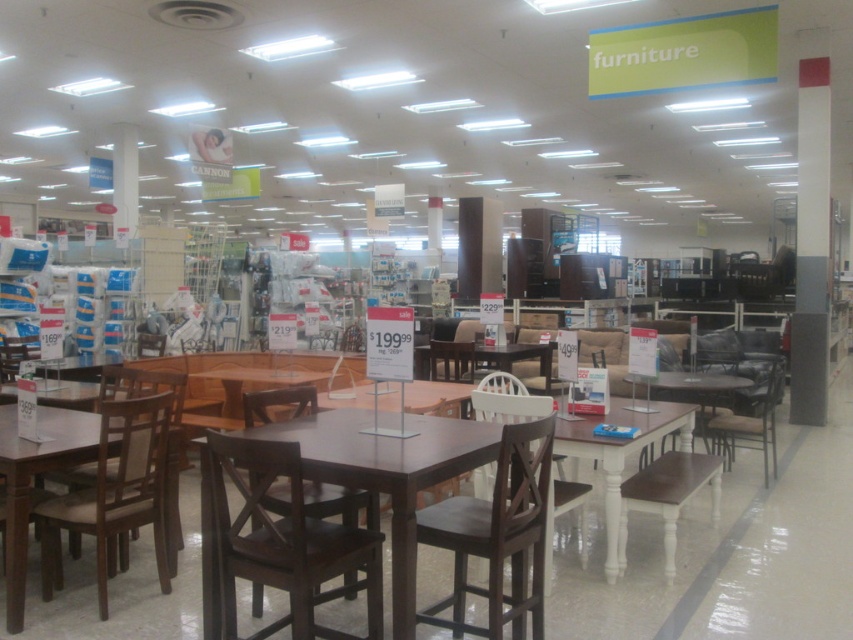
Looking at this image, you are a customer in the furniture store and want to sit down at the white wood table at center. Can you reach the matte brown chair at left from your current position near the entrance?

The matte brown chair at left is to the left of the white wood table at center, so you can reach it by moving towards the left side of the table.

You are a customer in the furniture store and want to know if the matte brown chair at left can fit under the white wood table at center. Based on their sizes, can it fit?

The matte brown chair at left is bigger than the white wood table at center, so it may not fit under the table since the chair is larger in size.

You are a customer in the furniture store and want to know if there is enough space between the dark wood table at center and the white wood chair at center to walk through comfortably. The store recommends at least 24 inches of clearance for easy movement. Can you walk through comfortably?

The dark wood table at center and white wood chair at center are 31.86 inches apart from each other, which is more than the recommended 24 inches of clearance. Therefore, you can walk through comfortably between them.